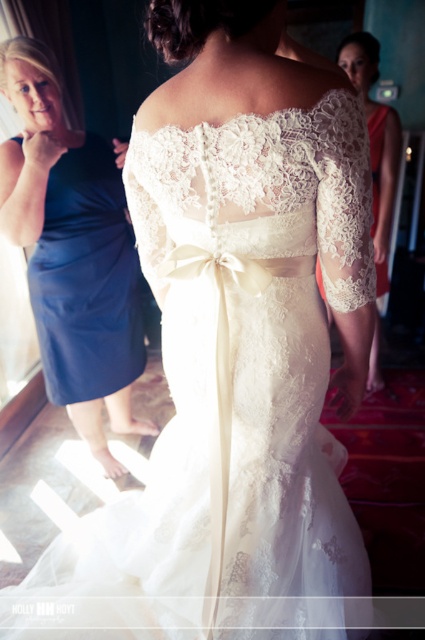
Question: Which of the following is the closest to the observer?

Choices:
 (A) (70, 346)
 (B) (382, 381)

Answer: (A)

Question: Does blue satin dress at left appear under lace fabric dress at upper right?

Choices:
 (A) yes
 (B) no

Answer: (A)

Question: From the image, what is the correct spatial relationship of blue satin dress at left in relation to lace fabric dress at upper right?

Choices:
 (A) right
 (B) left

Answer: (B)

Question: Can you confirm if blue satin dress at left is positioned to the left of lace fabric dress at upper right?

Choices:
 (A) yes
 (B) no

Answer: (A)